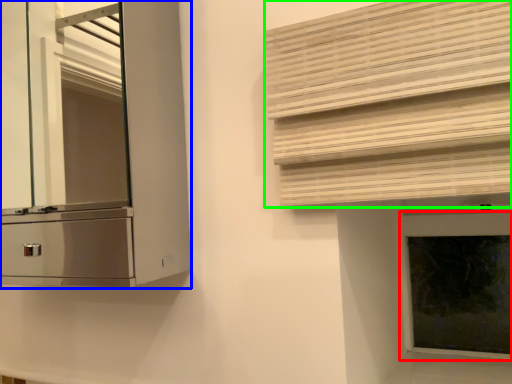
Question: Estimate the real-world distances between objects in this image. Which object is closer to window frame (highlighted by a red box), cabinetry (highlighted by a blue box) or shutter (highlighted by a green box)?

Choices:
 (A) cabinetry
 (B) shutter

Answer: (B)